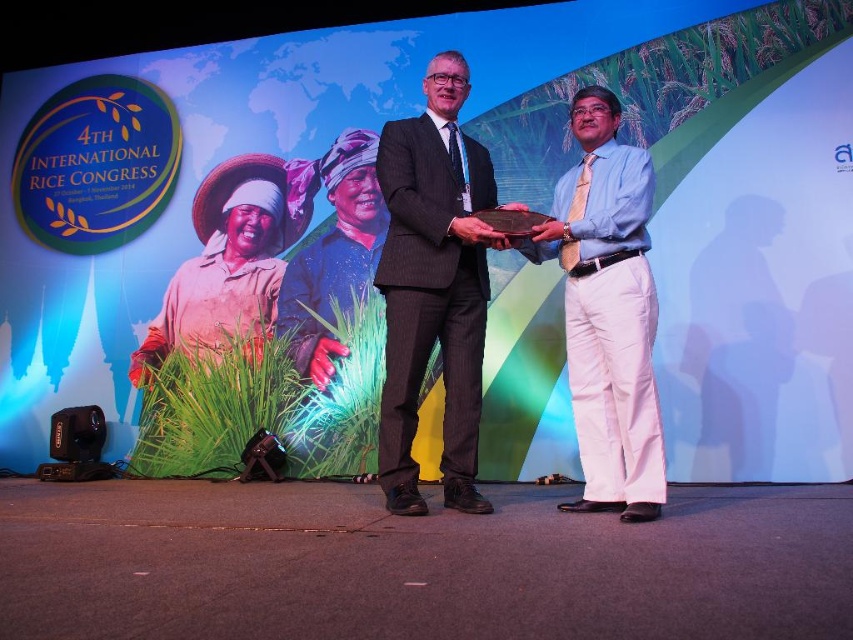
You are a photographer at the 4th International Rice Congress in Bangkok. You need to capture a photo of both the matte black suit at center and the light blue shirt at center. Which of the two should you zoom in on to ensure the subject fills the frame appropriately?

The matte black suit at center has a smaller size compared to the light blue shirt at center, so you should zoom in more on the matte black suit at center to ensure it fills the frame appropriately.